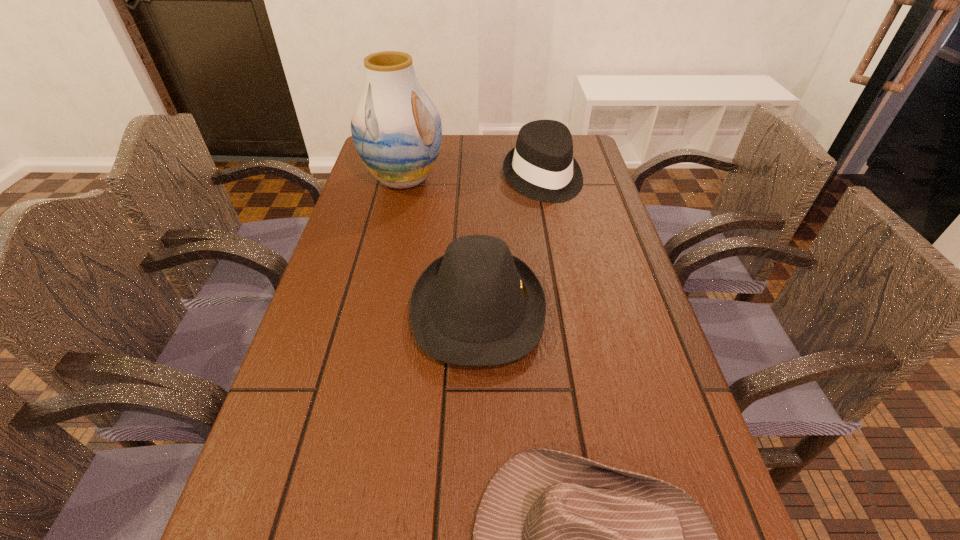
At what (x,y) coordinates should I click in order to perform the action: click on vase. Please return your answer as a coordinate pair (x, y). The image size is (960, 540). Looking at the image, I should click on (396, 129).

Where is `the farthest fedora`? This screenshot has height=540, width=960. the farthest fedora is located at coordinates (541, 166).

Find the location of a particular element. The height and width of the screenshot is (540, 960). the third farthest object is located at coordinates (477, 305).

Identify the location of free space located on the right of the tallest object. (504, 179).

Identify the location of vacant point located 0.110m on the back of the farthest fedora. This screenshot has height=540, width=960. (536, 139).

Identify the location of blank area located 0.110m on the front-facing side of the second nearest object. (595, 310).

Locate an element on the screen. The height and width of the screenshot is (540, 960). vase at the far edge is located at coordinates (396, 129).

Image resolution: width=960 pixels, height=540 pixels. I want to click on fedora that is at the far edge, so click(x=541, y=166).

The width and height of the screenshot is (960, 540). Identify the location of object situated at the left edge. (396, 129).

Find the location of a particular element. The image size is (960, 540). object situated at the right edge is located at coordinates (541, 166).